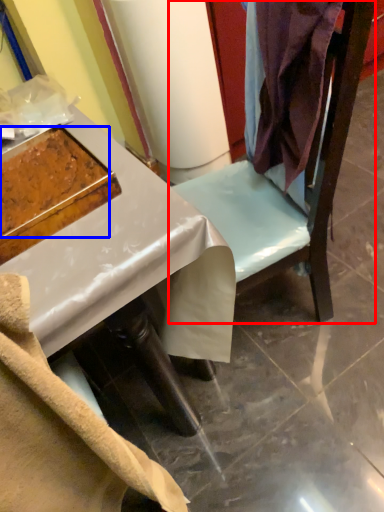
Question: Which object appears closest to the camera in this image, furniture (highlighted by a red box) or food (highlighted by a blue box)?

Choices:
 (A) furniture
 (B) food

Answer: (A)